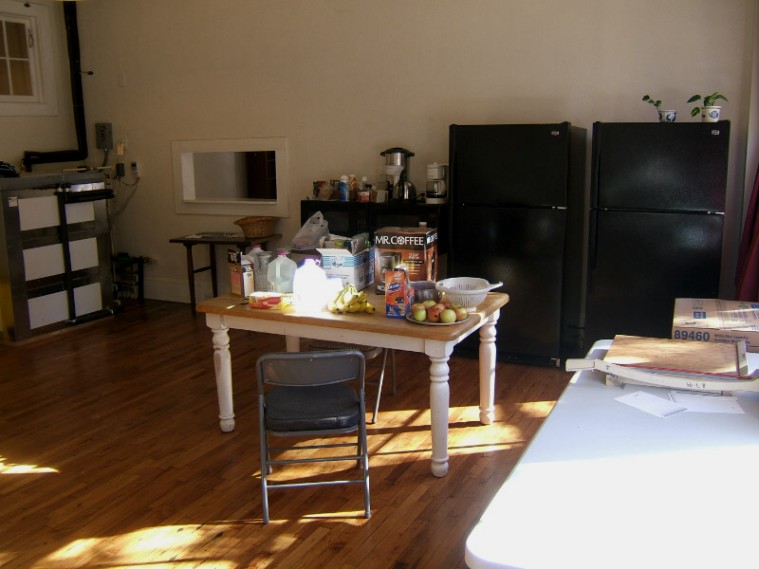
Where is `table`? The image size is (759, 569). table is located at coordinates (404, 340).